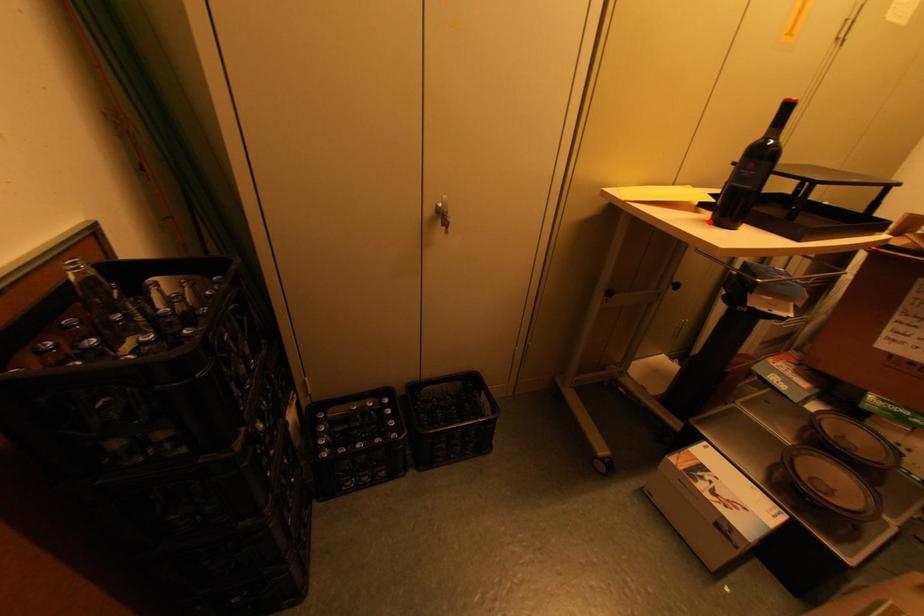
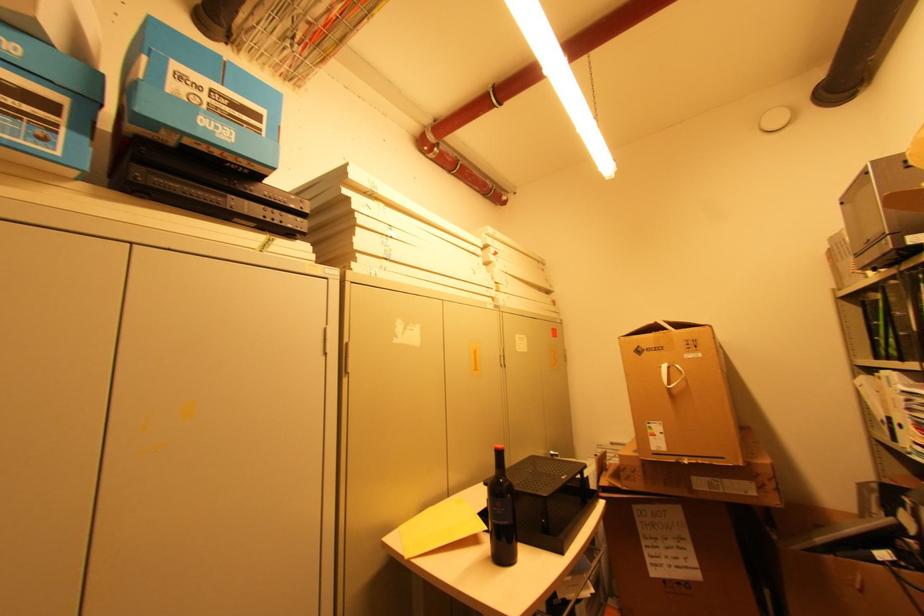
Question: I am providing you with two images of the same scene from different viewpoints. A red point is marked on the first image. At the location where the point appears in image 1, is it still visible in image 2?

Choices:
 (A) Yes
 (B) No

Answer: (A)